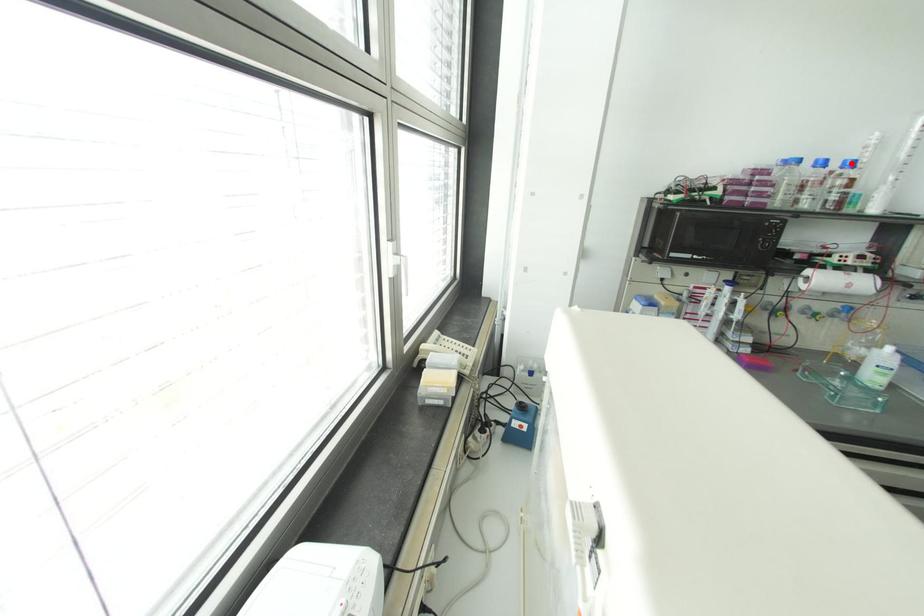
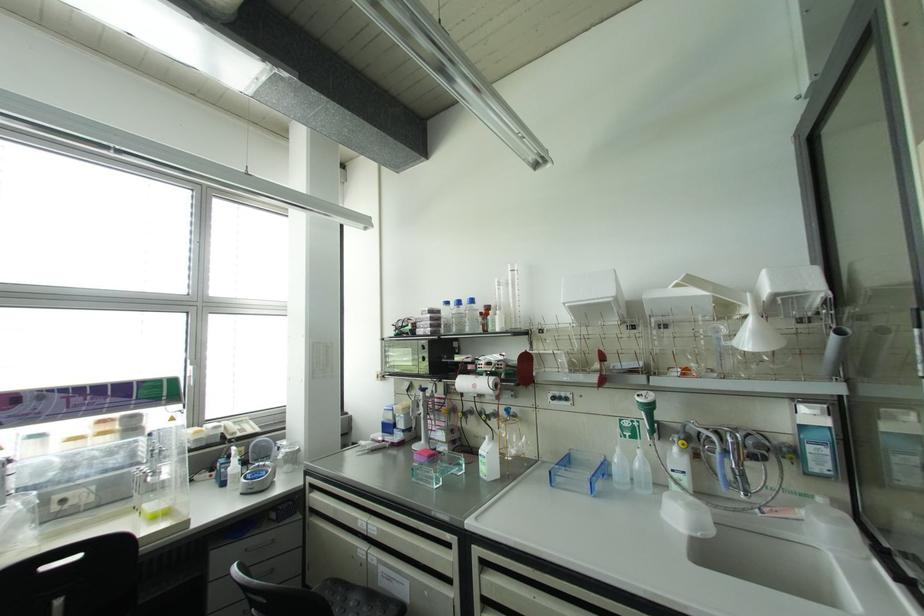
The point at the highlighted location is marked in the first image. Where is the corresponding point in the second image?

(471, 301)